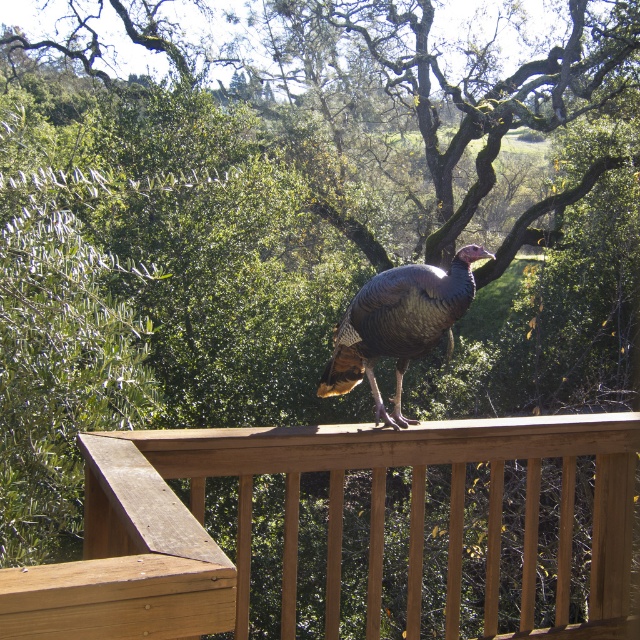
You are a photographer holding a camera with a 20 inch lens. You want to take a closeup shot of the gray matte turkey at center but need to stay behind the brown wooden railing at upper center. Can you position yourself so that the camera lens can reach the turkey without crossing the railing?

The brown wooden railing at upper center and gray matte turkey at center are 29.93 inches apart from each other. Since the camera lens is 20 inches long, you can extend it fully and still keep the railing between you and the turkey, allowing for a clear shot without crossing the railing.

You are standing at the lower edge of the image and want to locate the brown wooden railing at upper center. According to the coordinates provided, in which direction should you look to find it?

You should look upward because the brown wooden railing at upper center is located at point (328, 524), which is in the upper part of the image.